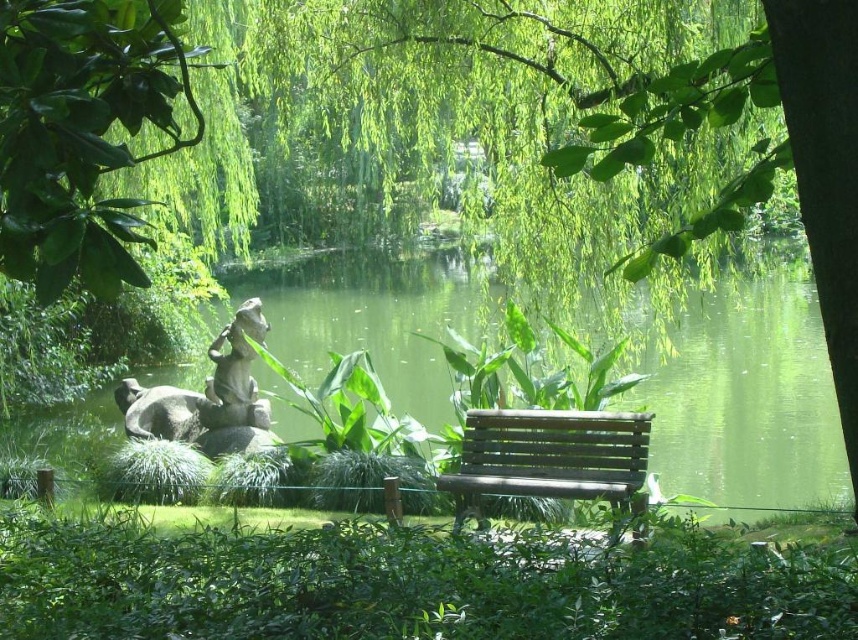
Question: Which point is farther to the camera?

Choices:
 (A) (248, 358)
 (B) (621, 420)

Answer: (A)

Question: Which object is positioned farthest from the green leafy tree at center?

Choices:
 (A) green water at center
 (B) wooden bench at center
 (C) green leafy tree at upper left
 (D) gray stone statue at center-left

Answer: (C)

Question: Does green water at center appear under wooden bench at center?

Choices:
 (A) no
 (B) yes

Answer: (A)

Question: Can you confirm if green leafy tree at center is wider than gray stone statue at center-left?

Choices:
 (A) no
 (B) yes

Answer: (B)

Question: From the image, what is the correct spatial relationship of green leafy tree at center in relation to green water at center?

Choices:
 (A) right
 (B) left

Answer: (A)

Question: Which is farther from the green water at center?

Choices:
 (A) wooden bench at center
 (B) green leafy tree at upper left
 (C) green leafy tree at center
 (D) gray stone statue at center-left

Answer: (B)